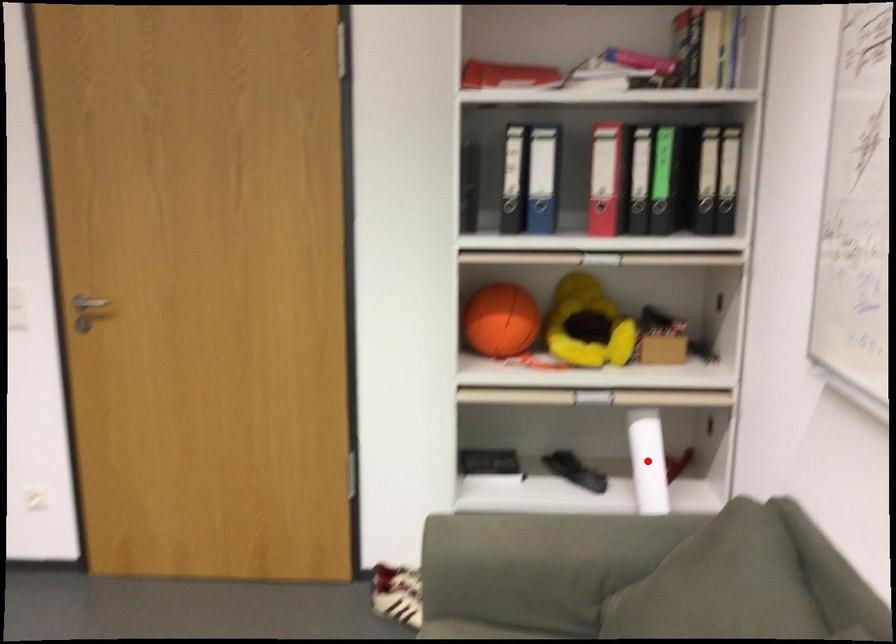
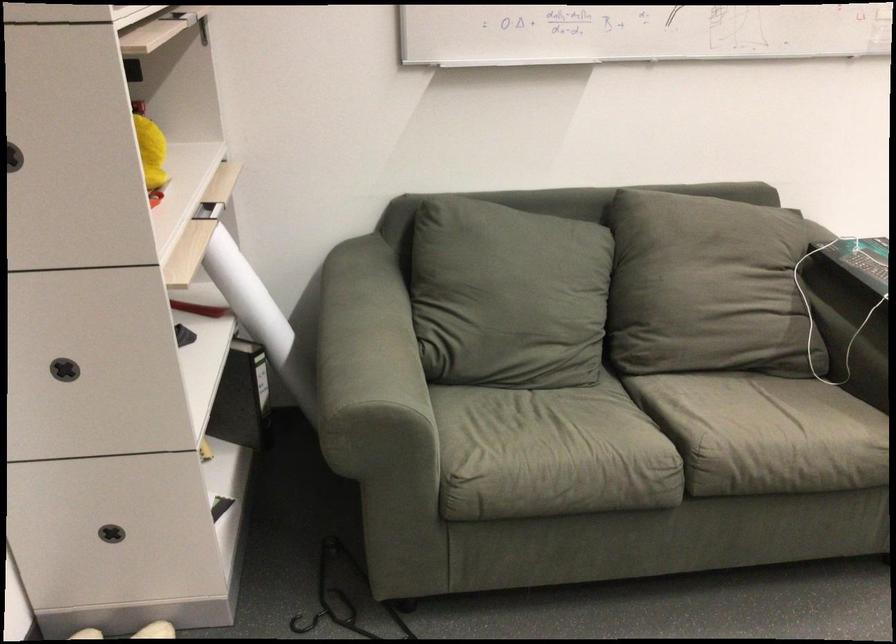
Question: I am providing you with two images of the same scene from different viewpoints. A red point is marked on the first image. Can you still see the location of the red point in image 2?

Choices:
 (A) Yes
 (B) No

Answer: (B)